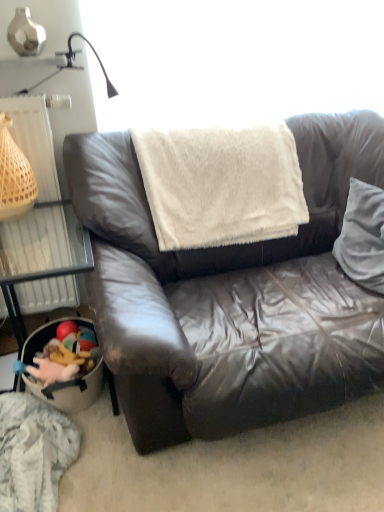
Question: Would you say plush toy at lower left is part of white plastic radiator at left's contents?

Choices:
 (A) no
 (B) yes

Answer: (A)

Question: Is there a large distance between white plastic radiator at left and plush toy at lower left?

Choices:
 (A) yes
 (B) no

Answer: (B)

Question: Is white plastic radiator at left positioned behind plush toy at lower left?

Choices:
 (A) no
 (B) yes

Answer: (A)

Question: Considering the relative sizes of white plastic radiator at left and plush toy at lower left in the image provided, is white plastic radiator at left taller than plush toy at lower left?

Choices:
 (A) no
 (B) yes

Answer: (B)

Question: Does white plastic radiator at left lie in front of plush toy at lower left?

Choices:
 (A) no
 (B) yes

Answer: (B)

Question: Looking at the image, does plush toy at lower left seem bigger or smaller compared to white soft pillow at right?

Choices:
 (A) small
 (B) big

Answer: (A)

Question: Is plush toy at lower left wider or thinner than white soft pillow at right?

Choices:
 (A) wide
 (B) thin

Answer: (B)

Question: Is plush toy at lower left inside or outside of white soft pillow at right?

Choices:
 (A) outside
 (B) inside

Answer: (A)

Question: Based on their positions, is plush toy at lower left located to the left or right of white soft pillow at right?

Choices:
 (A) left
 (B) right

Answer: (A)

Question: Would you say fluffy gray blanket at lower left is inside or outside leather couch at center?

Choices:
 (A) outside
 (B) inside

Answer: (A)

Question: Considering the relative positions of fluffy gray blanket at lower left and leather couch at center in the image provided, is fluffy gray blanket at lower left to the left or to the right of leather couch at center?

Choices:
 (A) right
 (B) left

Answer: (B)

Question: In terms of size, does fluffy gray blanket at lower left appear bigger or smaller than leather couch at center?

Choices:
 (A) small
 (B) big

Answer: (A)

Question: Considering the positions of fluffy gray blanket at lower left and leather couch at center in the image, is fluffy gray blanket at lower left wider or thinner than leather couch at center?

Choices:
 (A) wide
 (B) thin

Answer: (B)

Question: Considering their positions, is plush toy at lower left located in front of or behind beige woven basket at left?

Choices:
 (A) front
 (B) behind

Answer: (B)

Question: Is plush toy at lower left inside or outside of beige woven basket at left?

Choices:
 (A) inside
 (B) outside

Answer: (B)